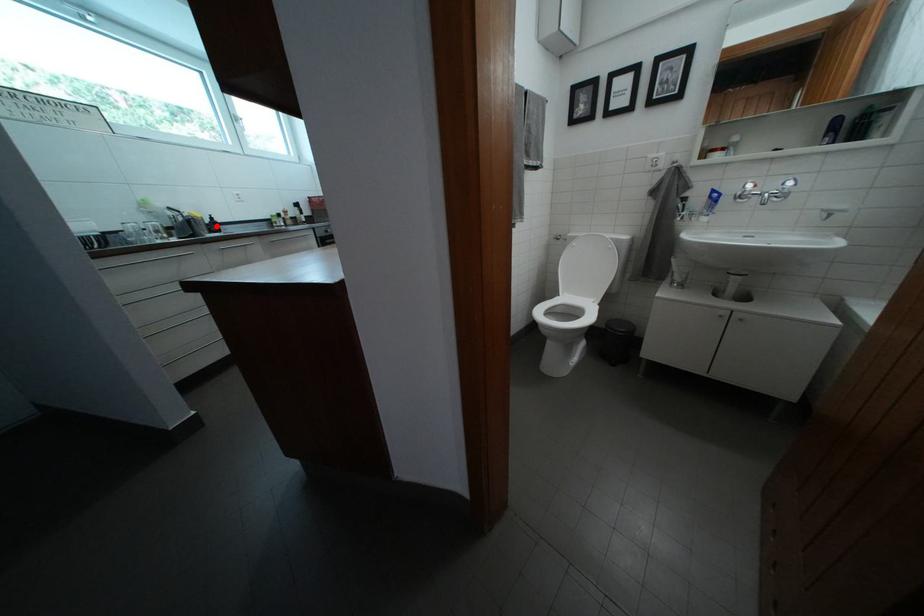
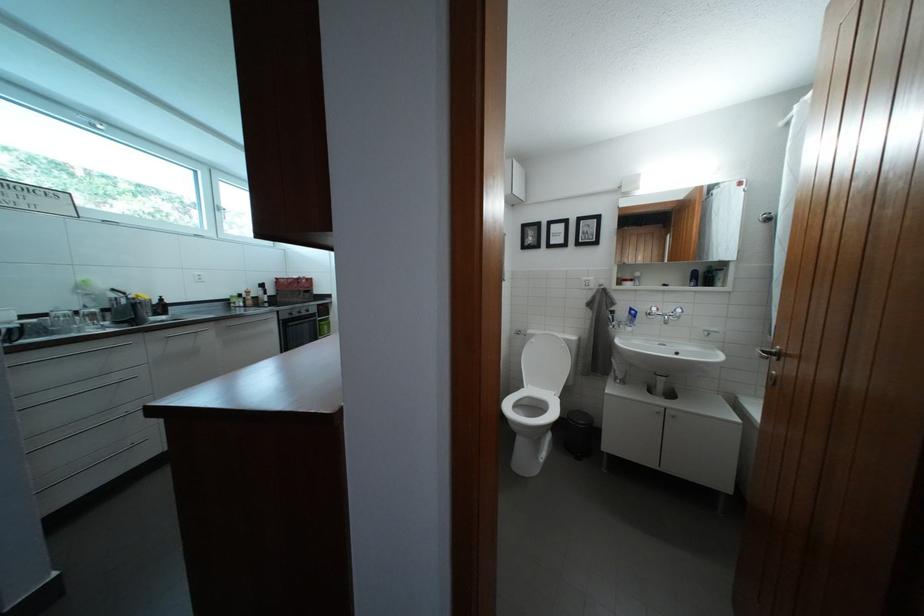
Find the pixel in the second image that matches the highlighted location in the first image.

(165, 307)